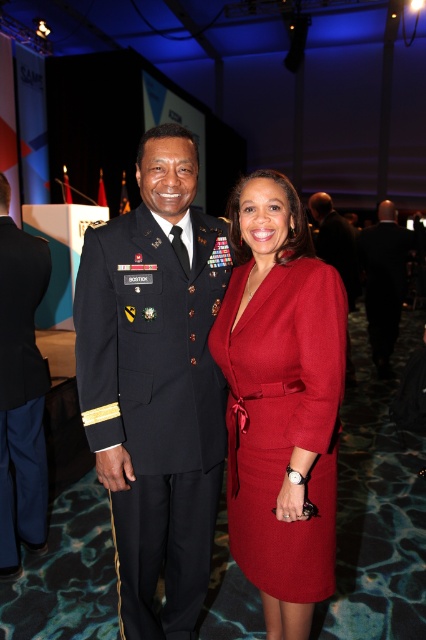
Is matte black military uniform at center positioned behind black wool suit at right?

No.

Which is below, matte black military uniform at center or black wool suit at right?

Positioned lower is matte black military uniform at center.

Is point (187, 196) more distant than point (379, 209)?

No, it is in front of (379, 209).

The image size is (426, 640). What are the coordinates of `matte black military uniform at center` in the screenshot? It's located at (155, 381).

Who is positioned more to the right, matte black military uniform at center or dark blue wool military uniform at left?

From the viewer's perspective, matte black military uniform at center appears more on the right side.

Where is `matte black military uniform at center`? This screenshot has height=640, width=426. matte black military uniform at center is located at coordinates (155, 381).

In the scene shown: Is matte black military uniform at center in front of matte black suit at center?

Yes, matte black military uniform at center is closer to the viewer.

How far apart are matte black military uniform at center and matte black suit at center?

matte black military uniform at center is 3.22 meters away from matte black suit at center.

Does point (331, 570) come farther from viewer compared to point (333, 236)?

No.

At what (x,y) coordinates should I click in order to perform the action: click on matte black military uniform at center. Please return your answer as a coordinate pair (x, y). Looking at the image, I should click on (155, 381).